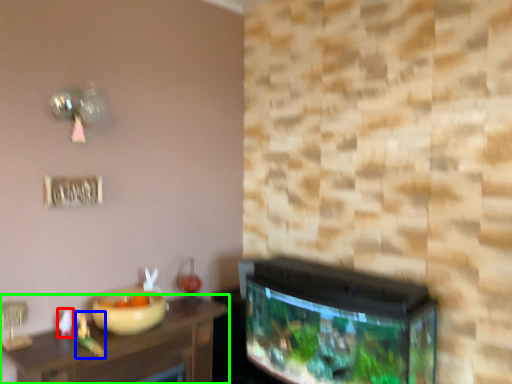
Question: Considering the real-world distances, which object is closest to toy (highlighted by a red box)? toy (highlighted by a blue box) or table (highlighted by a green box).

Choices:
 (A) toy
 (B) table

Answer: (A)